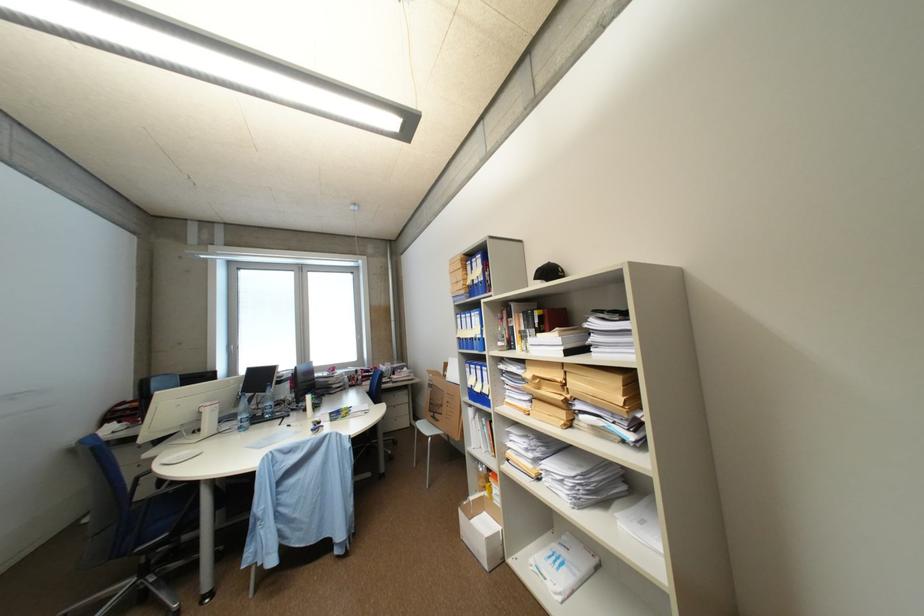
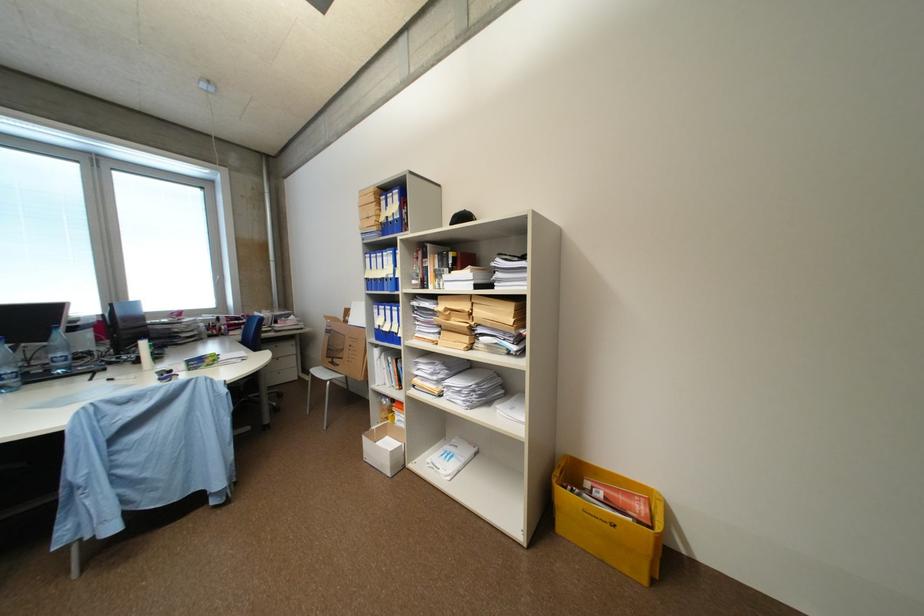
Where in the second image is the point corresponding to [277,405] from the first image?

(68, 355)